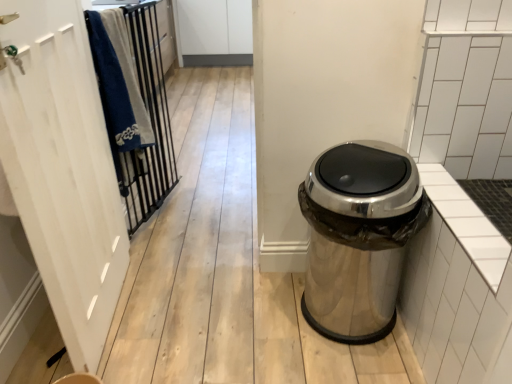
Question: Are polished metallic trash can at right and white wood screen door at left making contact?

Choices:
 (A) no
 (B) yes

Answer: (A)

Question: From a real-world perspective, is polished metallic trash can at right located higher than white wood screen door at left?

Choices:
 (A) yes
 (B) no

Answer: (B)

Question: Does polished metallic trash can at right have a larger size compared to white wood screen door at left?

Choices:
 (A) yes
 (B) no

Answer: (B)

Question: Can you confirm if polished metallic trash can at right is shorter than white wood screen door at left?

Choices:
 (A) yes
 (B) no

Answer: (A)

Question: Would you say polished metallic trash can at right is outside white wood screen door at left?

Choices:
 (A) yes
 (B) no

Answer: (A)

Question: From a real-world perspective, does polished metallic trash can at right sit lower than white wood screen door at left?

Choices:
 (A) yes
 (B) no

Answer: (A)

Question: Can you confirm if metallic black bars at left is positioned to the right of white wood screen door at left?

Choices:
 (A) yes
 (B) no

Answer: (A)

Question: Is metallic black bars at left further to camera compared to white wood screen door at left?

Choices:
 (A) yes
 (B) no

Answer: (A)

Question: Is metallic black bars at left positioned beyond the bounds of white wood screen door at left?

Choices:
 (A) no
 (B) yes

Answer: (B)

Question: From a real-world perspective, is metallic black bars at left under white wood screen door at left?

Choices:
 (A) yes
 (B) no

Answer: (A)

Question: From the image's perspective, is metallic black bars at left under white wood screen door at left?

Choices:
 (A) yes
 (B) no

Answer: (B)

Question: Is metallic black bars at left wider than white wood screen door at left?

Choices:
 (A) no
 (B) yes

Answer: (A)

Question: Can you confirm if polished metallic trash can at right is smaller than metallic black bars at left?

Choices:
 (A) no
 (B) yes

Answer: (A)